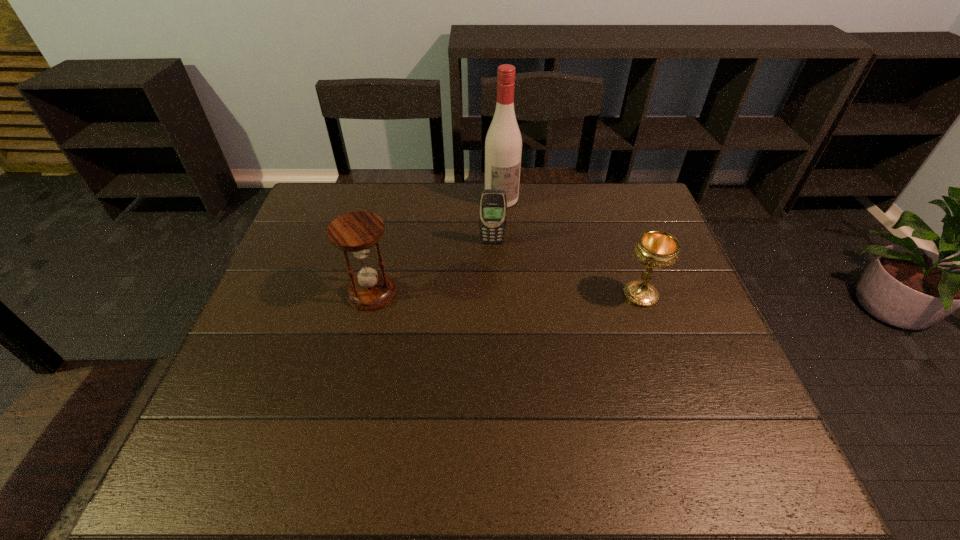
Locate an element on the screen. The image size is (960, 540). free region at the far left corner is located at coordinates (307, 212).

This screenshot has width=960, height=540. Identify the location of free space at the near left corner of the desktop. (287, 404).

Identify the location of vacant space at the far right corner of the desktop. This screenshot has height=540, width=960. (616, 197).

You are a GUI agent. You are given a task and a screenshot of the screen. Output one action in this format:
    pyautogui.click(x=<x>, y=<y>)
    Task: Click on the vacant space that's between the second tallest object and the third nearest object
    The image size is (960, 540).
    Given the screenshot: What is the action you would take?
    pyautogui.click(x=432, y=268)

Locate an element on the screen. Image resolution: width=960 pixels, height=540 pixels. unoccupied position between the rightmost object and the alcohol is located at coordinates pos(571,247).

You are a GUI agent. You are given a task and a screenshot of the screen. Output one action in this format:
    pyautogui.click(x=<x>, y=<y>)
    Task: Click on the free spot between the cellular telephone and the rightmost object
    The height and width of the screenshot is (540, 960).
    Given the screenshot: What is the action you would take?
    pyautogui.click(x=566, y=269)

Locate an element on the screen. This screenshot has width=960, height=540. free space between the rightmost object and the second tallest object is located at coordinates (506, 294).

The height and width of the screenshot is (540, 960). Find the location of `vacant point located between the rightmost object and the hourglass`. vacant point located between the rightmost object and the hourglass is located at coordinates (506, 294).

Find the location of a particular element. free space between the alcohol and the rightmost object is located at coordinates (571, 247).

Find the location of a particular element. The height and width of the screenshot is (540, 960). free space between the tallest object and the chalice is located at coordinates (571, 247).